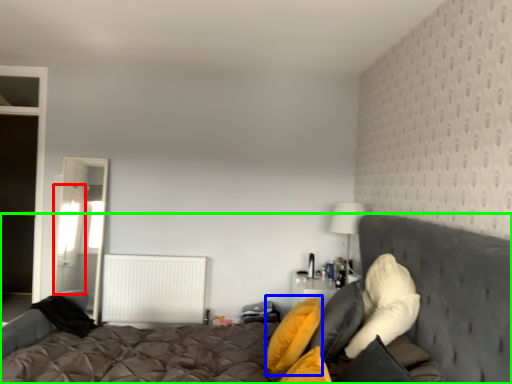
Question: Which object is the farthest from curtain (highlighted by a red box)? Choose among these: pillow (highlighted by a blue box) or bed (highlighted by a green box).

Choices:
 (A) pillow
 (B) bed

Answer: (A)